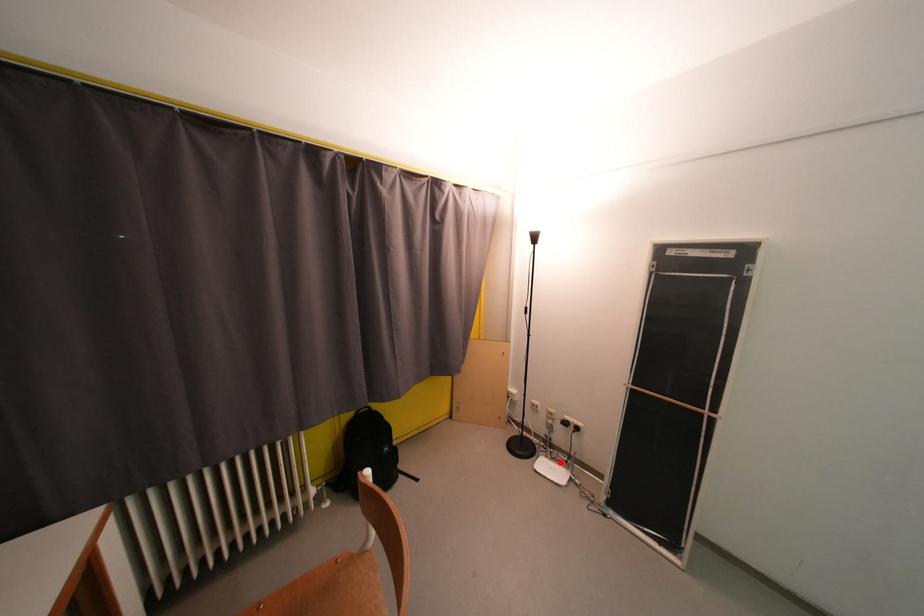
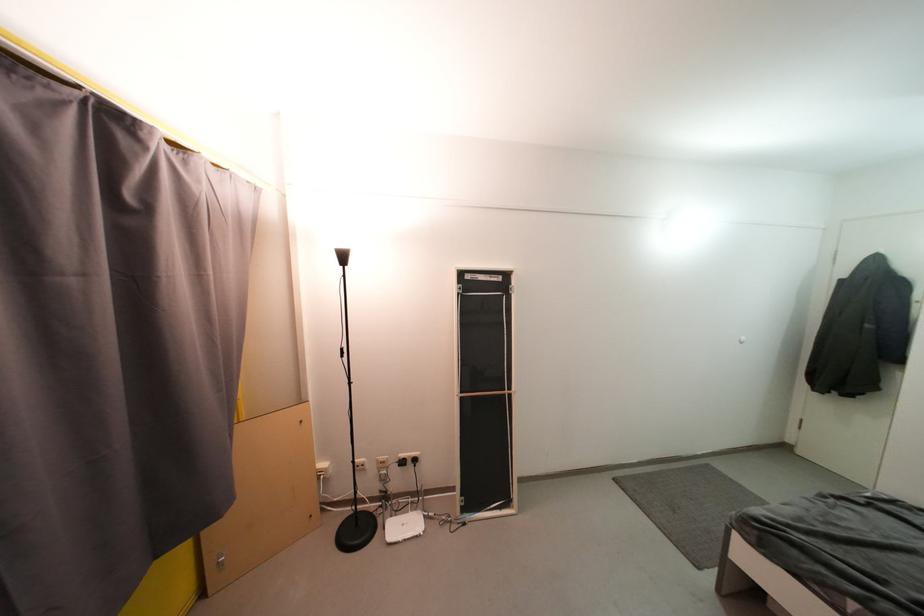
Question: I am providing you with two images of the same scene from different viewpoints. In image1, a red point is highlighted. Considering the same 3D point in image2, which of the following is correct?

Choices:
 (A) It is closer
 (B) It is farther

Answer: (B)